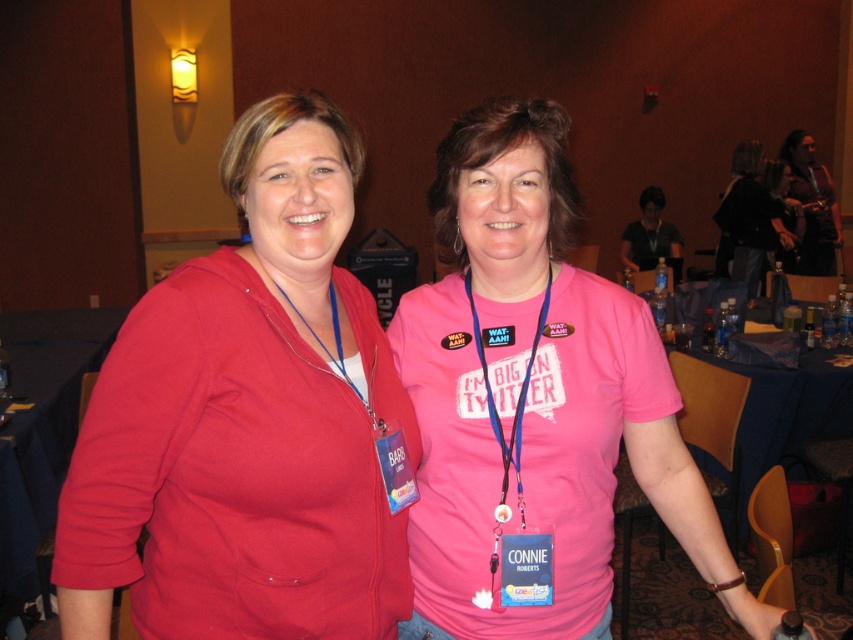
Which is in front, point (479, 628) or point (518, 566)?

Positioned in front is point (518, 566).

Who is positioned more to the right, pink fabric shirt at center or blue fabric lanyard at center?

From the viewer's perspective, pink fabric shirt at center appears more on the right side.

What do you see at coordinates (537, 394) in the screenshot? I see `pink fabric shirt at center` at bounding box center [537, 394].

Locate an element on the screen. This screenshot has width=853, height=640. pink fabric shirt at center is located at coordinates (537, 394).

Is the position of pink fabric shirt at center more distant than that of matte black shirt at center?

That is False.

Based on the photo, does pink fabric shirt at center have a greater height compared to matte black shirt at center?

No, pink fabric shirt at center is not taller than matte black shirt at center.

The height and width of the screenshot is (640, 853). In order to click on pink fabric shirt at center in this screenshot , I will do click(x=537, y=394).

Looking at this image, can you confirm if matte red hoodie at left is positioned below pink fabric shirt at center?

Actually, matte red hoodie at left is above pink fabric shirt at center.

Does matte red hoodie at left lie behind pink fabric shirt at center?

No, matte red hoodie at left is closer to the viewer.

You are a GUI agent. You are given a task and a screenshot of the screen. Output one action in this format:
    pyautogui.click(x=<x>, y=<y>)
    Task: Click on the matte red hoodie at left
    
    Given the screenshot: What is the action you would take?
    pyautogui.click(x=247, y=420)

Image resolution: width=853 pixels, height=640 pixels. What are the coordinates of `matte red hoodie at left` in the screenshot? It's located at (247, 420).